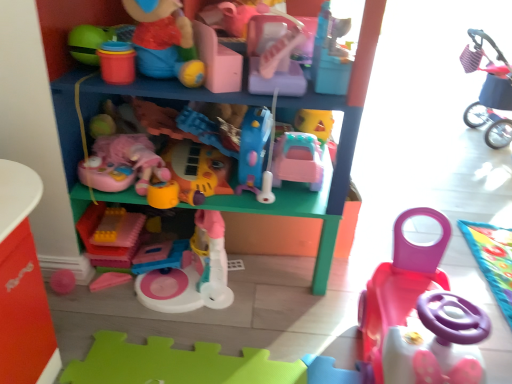
Describe the element at coordinates (158, 119) in the screenshot. The image size is (512, 384). I see `soft pink plush at center, the third toy from the left` at that location.

This screenshot has height=384, width=512. Describe the element at coordinates (191, 272) in the screenshot. I see `pink plastic toy at center, marked as the 2th toy in a left-to-right arrangement` at that location.

The image size is (512, 384). What are the coordinates of `pink plastic toy at center, the 7th toy in the right-to-left sequence` in the screenshot? It's located at (191, 272).

Describe the element at coordinates (102, 245) in the screenshot. I see `translucent yellow plastic blocks at center, the first toy when ordered from left to right` at that location.

What is the approximate height of pink plastic car at center, the 4th toy from the right?

It is 6.84 inches.

Where is `plush pink stroller at upper right, which ranks as the first toy in right-to-left order`? plush pink stroller at upper right, which ranks as the first toy in right-to-left order is located at coordinates (490, 89).

Is translucent yellow plastic blocks at center, the first toy when ordered from left to right, inside or outside of matte plastic toy at upper center, the 5th toy viewed from the right?

translucent yellow plastic blocks at center, the first toy when ordered from left to right, is located beyond the bounds of matte plastic toy at upper center, the 5th toy viewed from the right.

Is translucent yellow plastic blocks at center, the first toy when ordered from left to right, beside matte plastic toy at upper center, the 5th toy viewed from the right?

translucent yellow plastic blocks at center, the first toy when ordered from left to right, and matte plastic toy at upper center, the 5th toy viewed from the right, are clearly separated.

Considering the sizes of translucent yellow plastic blocks at center, the first toy when ordered from left to right, and matte plastic toy at upper center, the fourth toy positioned from the left, in the image, is translucent yellow plastic blocks at center, the first toy when ordered from left to right, bigger or smaller than matte plastic toy at upper center, the fourth toy positioned from the left,?

Clearly, translucent yellow plastic blocks at center, the first toy when ordered from left to right, is smaller in size than matte plastic toy at upper center, the fourth toy positioned from the left.

Looking at this image, considering the sizes of translucent yellow plastic blocks at center, placed as the eighth toy when sorted from right to left, and matte plastic toy at upper center, the 5th toy viewed from the right, in the image, is translucent yellow plastic blocks at center, placed as the eighth toy when sorted from right to left, taller or shorter than matte plastic toy at upper center, the 5th toy viewed from the right,?

translucent yellow plastic blocks at center, placed as the eighth toy when sorted from right to left, is shorter than matte plastic toy at upper center, the 5th toy viewed from the right.

Considering the positions of objects pink plastic toy car at lower right, the seventh toy positioned from the left, and matte plastic toy car at lower right in the image provided, who is more to the left, pink plastic toy car at lower right, the seventh toy positioned from the left, or matte plastic toy car at lower right?

matte plastic toy car at lower right is more to the left.

From a real-world perspective, which object stands above the other?

matte plastic toy car at lower right, from a real-world perspective.

Looking at their sizes, would you say pink plastic toy car at lower right, the seventh toy positioned from the left, is wider or thinner than matte plastic toy car at lower right?

Considering their sizes, pink plastic toy car at lower right, the seventh toy positioned from the left, looks slimmer than matte plastic toy car at lower right.

Which of these two, translucent yellow plastic blocks at center, placed as the eighth toy when sorted from right to left, or soft pink plush at center, which appears as the 6th toy when viewed from the right, stands taller?

soft pink plush at center, which appears as the 6th toy when viewed from the right, is taller.

Which toy is the 3rd one when counting from the front of the translucent yellow plastic blocks at center, the first toy when ordered from left to right? Please provide its 2D coordinates.

[(158, 119)]

Considering the positions of point (503, 134) and point (265, 76), is point (503, 134) closer or farther from the camera than point (265, 76)?

Point (503, 134) appears to be farther away from the viewer than point (265, 76).

Does plush pink stroller at upper right, which ranks as the first toy in right-to-left order, appear on the right side of matte plastic toy at upper center, the fourth toy positioned from the left?

Yes.

From a real-world perspective, is plush pink stroller at upper right, which ranks as the 8th toy in left-to-right order, physically above matte plastic toy at upper center, the 5th toy viewed from the right?

No, from a real-world perspective, plush pink stroller at upper right, which ranks as the 8th toy in left-to-right order, is not above matte plastic toy at upper center, the 5th toy viewed from the right.

In terms of width, does plush pink stroller at upper right, which ranks as the 8th toy in left-to-right order, look wider or thinner when compared to matte plastic toy at upper center, the fourth toy positioned from the left?

Considering their sizes, plush pink stroller at upper right, which ranks as the 8th toy in left-to-right order, looks slimmer than matte plastic toy at upper center, the fourth toy positioned from the left.

Looking at this image, is matte plastic toy car at lower right positioned far away from plush pink stroller at upper right, which ranks as the first toy in right-to-left order?

Yes, matte plastic toy car at lower right and plush pink stroller at upper right, which ranks as the first toy in right-to-left order, are quite far apart.

Considering their positions, is matte plastic toy car at lower right located in front of or behind plush pink stroller at upper right, which ranks as the 8th toy in left-to-right order?

matte plastic toy car at lower right is positioned closer to the viewer than plush pink stroller at upper right, which ranks as the 8th toy in left-to-right order.

Between matte plastic toy car at lower right and plush pink stroller at upper right, which ranks as the first toy in right-to-left order, which one has less height?

plush pink stroller at upper right, which ranks as the first toy in right-to-left order, is shorter.

Do you think matte plastic toy car at lower right is within plush pink stroller at upper right, which ranks as the first toy in right-to-left order, or outside of it?

→ matte plastic toy car at lower right exists outside the volume of plush pink stroller at upper right, which ranks as the first toy in right-to-left order.

From their relative heights in the image, would you say pink plastic toy at center, the 6th toy when ordered from left to right, is taller or shorter than pink plastic toy car at lower right, marked as the 2th toy in a right-to-left arrangement?

pink plastic toy at center, the 6th toy when ordered from left to right, is shorter than pink plastic toy car at lower right, marked as the 2th toy in a right-to-left arrangement.

Which of these two, pink plastic toy at center, the 6th toy when ordered from left to right, or pink plastic toy car at lower right, marked as the 2th toy in a right-to-left arrangement, is bigger?

pink plastic toy at center, the 6th toy when ordered from left to right.

From the image's perspective, who appears lower, pink plastic toy at center, which ranks as the 3th toy in right-to-left order, or pink plastic toy car at lower right, the seventh toy positioned from the left?

pink plastic toy car at lower right, the seventh toy positioned from the left, from the image's perspective.

From a real-world perspective, is pink plastic toy car at lower right, marked as the 2th toy in a right-to-left arrangement, on soft pink plush at center, which appears as the 6th toy when viewed from the right?

Actually, pink plastic toy car at lower right, marked as the 2th toy in a right-to-left arrangement, is physically below soft pink plush at center, which appears as the 6th toy when viewed from the right, in the real world.

Is pink plastic toy car at lower right, the seventh toy positioned from the left, closer to camera compared to soft pink plush at center, which appears as the 6th toy when viewed from the right?

Yes, pink plastic toy car at lower right, the seventh toy positioned from the left, is closer to the viewer.

Who is bigger, pink plastic toy car at lower right, marked as the 2th toy in a right-to-left arrangement, or soft pink plush at center, which appears as the 6th toy when viewed from the right?

With larger size is pink plastic toy car at lower right, marked as the 2th toy in a right-to-left arrangement.

Does point (369, 340) come closer to viewer compared to point (142, 108)?

Yes, point (369, 340) is closer to viewer.

From the matte plastic toy at upper center, the 5th toy viewed from the right, count 5th toys backward and point to it. Please provide its 2D coordinates.

[(102, 245)]

Identify the location of shelf above the pink plastic toy car at lower right, the seventh toy positioned from the left (from a real-world perspective). (343, 132).

When comparing their distances from pink plastic car at center, the 4th toy from the right, does pink plastic toy at center, the 7th toy in the right-to-left sequence, or plush pink stroller at upper right, which ranks as the 8th toy in left-to-right order, seem closer?

pink plastic toy at center, the 7th toy in the right-to-left sequence, is closer to pink plastic car at center, the 4th toy from the right.

Looking at the image, which one is located further to pink plastic toy car at lower right, the seventh toy positioned from the left, translucent yellow plastic blocks at center, the first toy when ordered from left to right, or matte plastic toy at upper center, the fourth toy positioned from the left?

translucent yellow plastic blocks at center, the first toy when ordered from left to right, is further to pink plastic toy car at lower right, the seventh toy positioned from the left.

Estimate the real-world distances between objects in this image. Which object is further from pink plastic car at center, the 4th toy from the right, translucent yellow plastic blocks at center, placed as the eighth toy when sorted from right to left, or soft pink plush at center, the third toy from the left?

translucent yellow plastic blocks at center, placed as the eighth toy when sorted from right to left.

From the image, which object appears to be farther from pink plastic toy at center, which ranks as the 3th toy in right-to-left order, translucent yellow plastic blocks at center, the first toy when ordered from left to right, or pink plastic car at center, arranged as the 5th toy when viewed from the left?

translucent yellow plastic blocks at center, the first toy when ordered from left to right, lies further to pink plastic toy at center, which ranks as the 3th toy in right-to-left order, than the other object.

Which object lies nearer to the anchor point pink plastic toy at center, marked as the 2th toy in a left-to-right arrangement, matte plastic toy car at lower right or pink plastic toy at center, the 6th toy when ordered from left to right?

The object closer to pink plastic toy at center, marked as the 2th toy in a left-to-right arrangement, is pink plastic toy at center, the 6th toy when ordered from left to right.

Considering their positions, is matte plastic toy car at lower right positioned closer to soft pink plush at center, the third toy from the left, than pink plastic car at center, the 4th toy from the right?

Based on the image, matte plastic toy car at lower right appears to be nearer to soft pink plush at center, the third toy from the left.

Based on their spatial positions, is matte plastic toy car at lower right or plush pink stroller at upper right, which ranks as the 8th toy in left-to-right order, closer to pink plastic toy at center, which ranks as the 3th toy in right-to-left order?

matte plastic toy car at lower right is positioned closer to the anchor pink plastic toy at center, which ranks as the 3th toy in right-to-left order.

From the image, which object appears to be farther from soft pink plush at center, the third toy from the left, pink plastic car at center, the 4th toy from the right, or pink plastic toy at center, marked as the 2th toy in a left-to-right arrangement?

Among the two, pink plastic toy at center, marked as the 2th toy in a left-to-right arrangement, is located further to soft pink plush at center, the third toy from the left.

At what (x,y) coordinates should I click in order to perform the action: click on toy situated between soft pink plush at center, which appears as the 6th toy when viewed from the right, and pink plastic car at center, arranged as the 5th toy when viewed from the left, from left to right. Please return your answer as a coordinate pair (x, y). Looking at the image, I should click on (272, 37).

The width and height of the screenshot is (512, 384). Identify the location of shelf between matte plastic toy at upper center, the 5th toy viewed from the right, and pink plastic toy at center, the 7th toy in the right-to-left sequence, from top to bottom. (343, 132).

Identify the location of shelf between translucent yellow plastic blocks at center, placed as the eighth toy when sorted from right to left, and pink plastic toy car at lower right, marked as the 2th toy in a right-to-left arrangement, from left to right. The width and height of the screenshot is (512, 384). (343, 132).

Image resolution: width=512 pixels, height=384 pixels. Identify the location of shelf situated between soft pink plush at center, which appears as the 6th toy when viewed from the right, and pink plastic toy car at lower right, marked as the 2th toy in a right-to-left arrangement, from left to right. (343, 132).